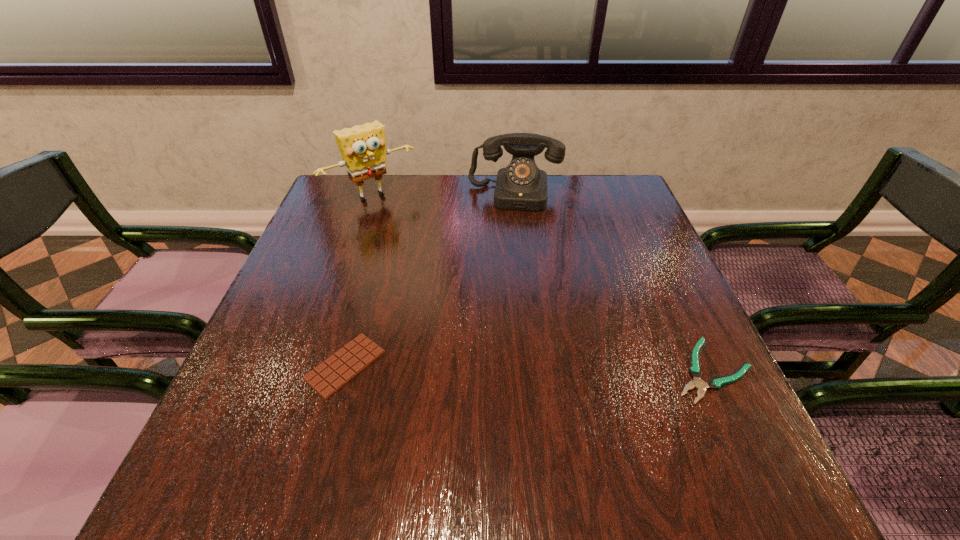
The width and height of the screenshot is (960, 540). In order to click on vacant spot on the desktop that is between the candy bar and the rightmost object and is positioned on the dial of the third object from left to right in this screenshot , I will do `click(500, 368)`.

Where is `free space on the desktop that is between the candy bar and the pliers and is positioned on the face of the tallest object`? This screenshot has width=960, height=540. free space on the desktop that is between the candy bar and the pliers and is positioned on the face of the tallest object is located at coordinates (533, 368).